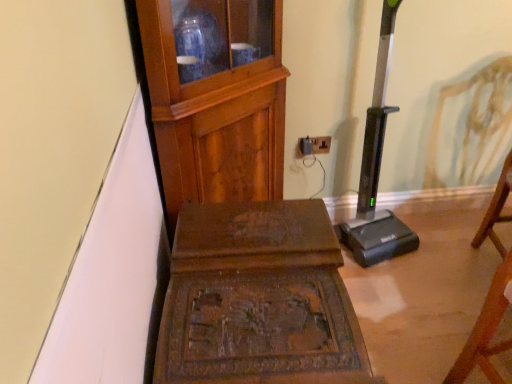
Find the location of `black plastic outlet at center`. black plastic outlet at center is located at coordinates (314, 145).

I want to click on wooden cabinet at upper left, the 1th furniture viewed from the left, so click(x=215, y=98).

From a real-world perspective, count 1st furnitures upward from the black plastic outlet at center and point to it. Please provide its 2D coordinates.

[(489, 292)]

Is wooden chair at right, arranged as the third furniture when viewed from the left, thinner than black plastic outlet at center?

In fact, wooden chair at right, arranged as the third furniture when viewed from the left, might be wider than black plastic outlet at center.

From the image's perspective, is wooden chair at right, which appears as the first furniture when viewed from the right, beneath black plastic outlet at center?

Yes, from the image's perspective, wooden chair at right, which appears as the first furniture when viewed from the right, is below black plastic outlet at center.

Which of these two, black plastic outlet at center or wooden chair at right, which appears as the first furniture when viewed from the right, is thinner?

With smaller width is black plastic outlet at center.

Between black plastic outlet at center and wooden chair at right, arranged as the third furniture when viewed from the left, which one appears on the left side from the viewer's perspective?

From the viewer's perspective, black plastic outlet at center appears more on the left side.

From the picture: Considering the relative sizes of carved wood table at center, marked as the second furniture in a left-to-right arrangement, and black plastic outlet at center in the image provided, is carved wood table at center, marked as the second furniture in a left-to-right arrangement, thinner than black plastic outlet at center?

No, carved wood table at center, marked as the second furniture in a left-to-right arrangement, is not thinner than black plastic outlet at center.

From a real-world perspective, is carved wood table at center, the second furniture in the right-to-left sequence, physically below black plastic outlet at center?

Yes, from a real-world perspective, carved wood table at center, the second furniture in the right-to-left sequence, is beneath black plastic outlet at center.

How many degrees apart are the facing directions of carved wood table at center, marked as the second furniture in a left-to-right arrangement, and black plastic outlet at center?

The angle between the facing direction of carved wood table at center, marked as the second furniture in a left-to-right arrangement, and the facing direction of black plastic outlet at center is 89.7 degrees.

How much distance is there between carved wood table at center, marked as the second furniture in a left-to-right arrangement, and black plastic outlet at center?

carved wood table at center, marked as the second furniture in a left-to-right arrangement, and black plastic outlet at center are 34.69 inches apart.

Is carved wood table at center, marked as the second furniture in a left-to-right arrangement, a part of wooden chair at right, which appears as the first furniture when viewed from the right?

No.

Considering the relative sizes of wooden chair at right, which appears as the first furniture when viewed from the right, and carved wood table at center, marked as the second furniture in a left-to-right arrangement, in the image provided, is wooden chair at right, which appears as the first furniture when viewed from the right, thinner than carved wood table at center, marked as the second furniture in a left-to-right arrangement,?

Yes, wooden chair at right, which appears as the first furniture when viewed from the right, is thinner than carved wood table at center, marked as the second furniture in a left-to-right arrangement.

Identify the location of furniture located in front of the carved wood table at center, the second furniture in the right-to-left sequence. (489, 292).

Is there a large distance between black plastic outlet at center and wooden cabinet at upper left, the 1th furniture viewed from the left?

No, black plastic outlet at center is not far from wooden cabinet at upper left, the 1th furniture viewed from the left.

Could you tell me if black plastic outlet at center is turned towards wooden cabinet at upper left, which is counted as the third furniture, starting from the right?

No.

Considering the positions of points (300, 142) and (168, 116), is point (300, 142) farther from camera compared to point (168, 116)?

Yes.

Does black plastic outlet at center contain wooden cabinet at upper left, the 1th furniture viewed from the left?

No, wooden cabinet at upper left, the 1th furniture viewed from the left, is not surrounded by black plastic outlet at center.

Who is smaller, wooden cabinet at upper left, which is counted as the third furniture, starting from the right, or wooden chair at right, which appears as the first furniture when viewed from the right?

With smaller size is wooden chair at right, which appears as the first furniture when viewed from the right.

Could wooden chair at right, which appears as the first furniture when viewed from the right, be considered to be inside wooden cabinet at upper left, which is counted as the third furniture, starting from the right?

Actually, wooden chair at right, which appears as the first furniture when viewed from the right, is outside wooden cabinet at upper left, which is counted as the third furniture, starting from the right.

The width and height of the screenshot is (512, 384). Identify the location of the 2nd furniture to the right of the wooden cabinet at upper left, the 1th furniture viewed from the left, counting from the anchor's position. (489, 292).

From a real-world perspective, between wooden cabinet at upper left, which is counted as the third furniture, starting from the right, and wooden chair at right, arranged as the third furniture when viewed from the left, who is vertically higher?

wooden cabinet at upper left, which is counted as the third furniture, starting from the right.

How different are the orientations of wooden chair at right, arranged as the third furniture when viewed from the left, and wooden cabinet at upper left, the 1th furniture viewed from the left, in degrees?

There is a 46.2-degree angle between the facing directions of wooden chair at right, arranged as the third furniture when viewed from the left, and wooden cabinet at upper left, the 1th furniture viewed from the left.

Measure the distance between wooden chair at right, which appears as the first furniture when viewed from the right, and wooden cabinet at upper left, the 1th furniture viewed from the left.

wooden chair at right, which appears as the first furniture when viewed from the right, and wooden cabinet at upper left, the 1th furniture viewed from the left, are 38.79 inches apart from each other.

Considering the relative sizes of wooden chair at right, which appears as the first furniture when viewed from the right, and wooden cabinet at upper left, which is counted as the third furniture, starting from the right, in the image provided, is wooden chair at right, which appears as the first furniture when viewed from the right, taller than wooden cabinet at upper left, which is counted as the third furniture, starting from the right,?

Incorrect, the height of wooden chair at right, which appears as the first furniture when viewed from the right, is not larger of that of wooden cabinet at upper left, which is counted as the third furniture, starting from the right.

From the image's perspective, is wooden chair at right, arranged as the third furniture when viewed from the left, above wooden cabinet at upper left, the 1th furniture viewed from the left?

No, from the image's perspective, wooden chair at right, arranged as the third furniture when viewed from the left, is not on top of wooden cabinet at upper left, the 1th furniture viewed from the left.

The image size is (512, 384). Find the location of `electric outlet that appears behind the wooden chair at right, which appears as the first furniture when viewed from the right`. electric outlet that appears behind the wooden chair at right, which appears as the first furniture when viewed from the right is located at coordinates (314, 145).

The image size is (512, 384). In order to click on electric outlet that appears on the left of wooden chair at right, arranged as the third furniture when viewed from the left in this screenshot , I will do `click(314, 145)`.

Looking at the image, which one is located further to carved wood table at center, the second furniture in the right-to-left sequence, wooden chair at right, which appears as the first furniture when viewed from the right, or wooden cabinet at upper left, which is counted as the third furniture, starting from the right?

wooden chair at right, which appears as the first furniture when viewed from the right, is further to carved wood table at center, the second furniture in the right-to-left sequence.

Based on their spatial positions, is black plastic outlet at center or carved wood table at center, the second furniture in the right-to-left sequence, further from wooden cabinet at upper left, which is counted as the third furniture, starting from the right?

Among the two, black plastic outlet at center is located further to wooden cabinet at upper left, which is counted as the third furniture, starting from the right.

Estimate the real-world distances between objects in this image. Which object is further from wooden cabinet at upper left, which is counted as the third furniture, starting from the right, carved wood table at center, marked as the second furniture in a left-to-right arrangement, or wooden chair at right, which appears as the first furniture when viewed from the right?

wooden chair at right, which appears as the first furniture when viewed from the right.

Which object lies further to the anchor point wooden chair at right, arranged as the third furniture when viewed from the left, carved wood table at center, marked as the second furniture in a left-to-right arrangement, or black plastic outlet at center?

Based on the image, black plastic outlet at center appears to be further to wooden chair at right, arranged as the third furniture when viewed from the left.

Estimate the real-world distances between objects in this image. Which object is closer to black plastic outlet at center, wooden chair at right, arranged as the third furniture when viewed from the left, or wooden cabinet at upper left, the 1th furniture viewed from the left?

wooden cabinet at upper left, the 1th furniture viewed from the left, is closer to black plastic outlet at center.

Which object lies further to the anchor point carved wood table at center, the second furniture in the right-to-left sequence, black plastic outlet at center or wooden cabinet at upper left, which is counted as the third furniture, starting from the right?

black plastic outlet at center lies further to carved wood table at center, the second furniture in the right-to-left sequence, than the other object.

Considering their positions, is wooden chair at right, which appears as the first furniture when viewed from the right, positioned closer to wooden cabinet at upper left, the 1th furniture viewed from the left, than black plastic outlet at center?

Based on the image, black plastic outlet at center appears to be nearer to wooden cabinet at upper left, the 1th furniture viewed from the left.

Estimate the real-world distances between objects in this image. Which object is closer to wooden cabinet at upper left, the 1th furniture viewed from the left, wooden chair at right, arranged as the third furniture when viewed from the left, or carved wood table at center, the second furniture in the right-to-left sequence?

carved wood table at center, the second furniture in the right-to-left sequence, lies closer to wooden cabinet at upper left, the 1th furniture viewed from the left, than the other object.

The image size is (512, 384). I want to click on furniture between wooden cabinet at upper left, which is counted as the third furniture, starting from the right, and wooden chair at right, arranged as the third furniture when viewed from the left, from left to right, so click(258, 299).

Identify the location of furniture between carved wood table at center, the second furniture in the right-to-left sequence, and black plastic outlet at center from front to back. Image resolution: width=512 pixels, height=384 pixels. (215, 98).